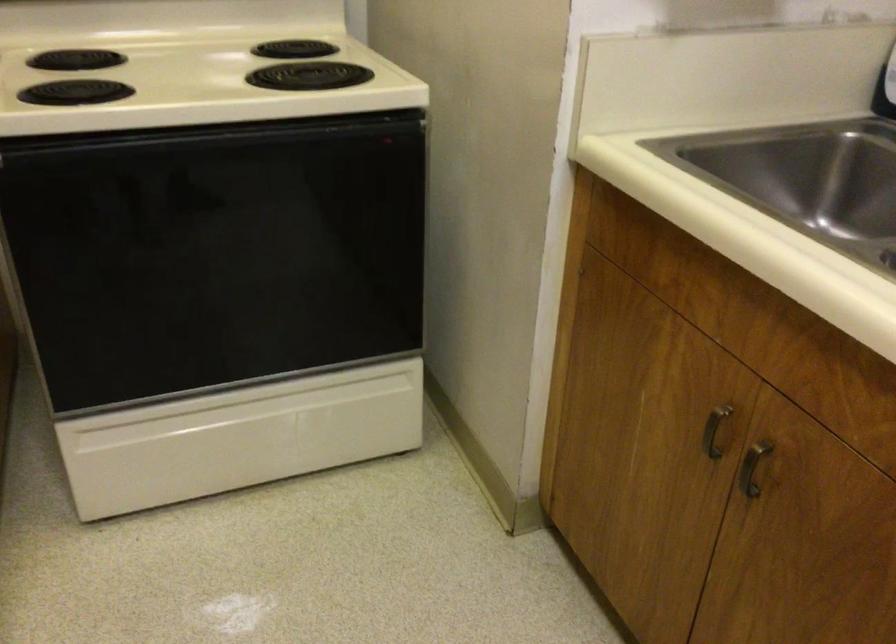
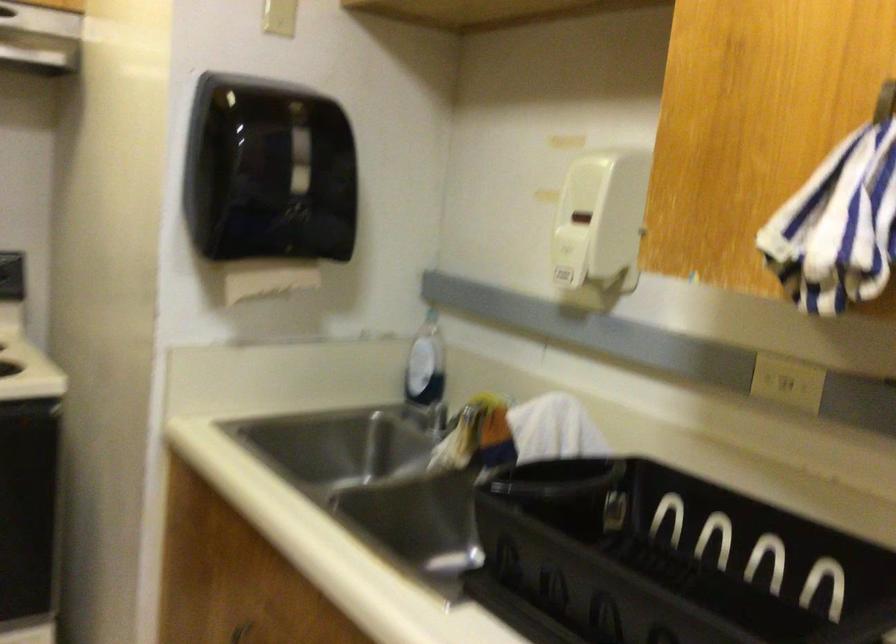
The images are taken continuously from a first-person perspective. In which direction is your viewpoint rotating?

The camera's rotation is toward right-up.